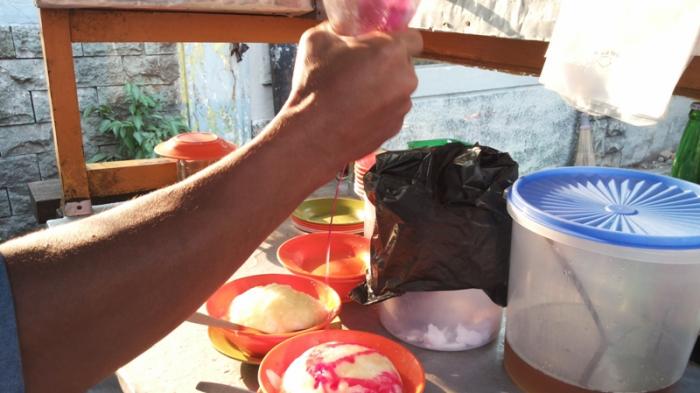
The width and height of the screenshot is (700, 393). Find the location of `clear container`. clear container is located at coordinates (438, 306), (645, 301).